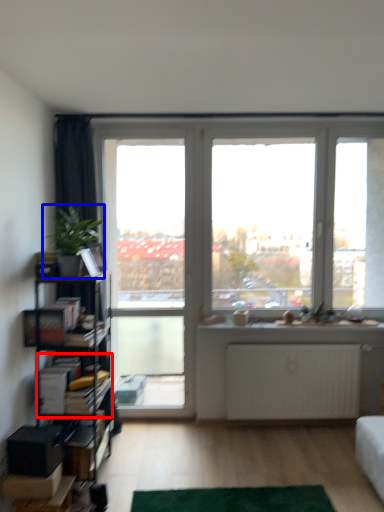
Question: Which object appears closest to the camera in this image, book (highlighted by a red box) or houseplant (highlighted by a blue box)?

Choices:
 (A) book
 (B) houseplant

Answer: (B)